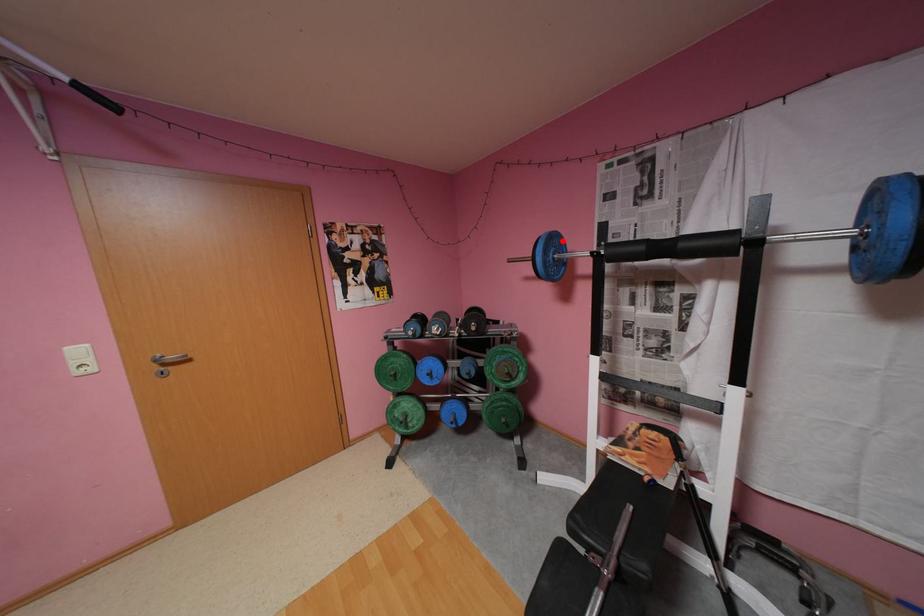
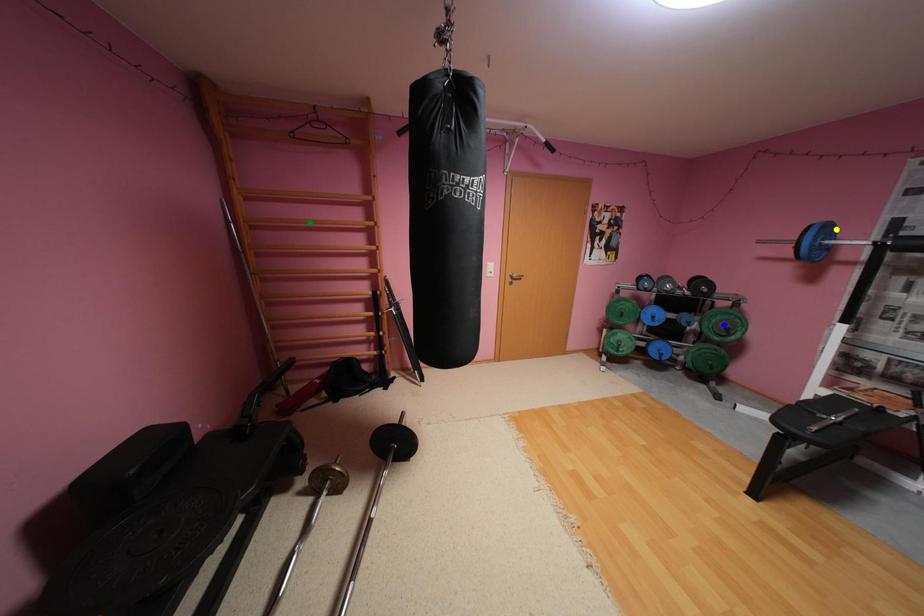
Question: I am providing you with two images of the same scene from different viewpoints. A red point is marked on the first image. You are given multiple points on the second image. Can you choose the point in image 2 that corresponds to the point in image 1?

Choices:
 (A) blue point
 (B) green point
 (C) yellow point

Answer: (C)